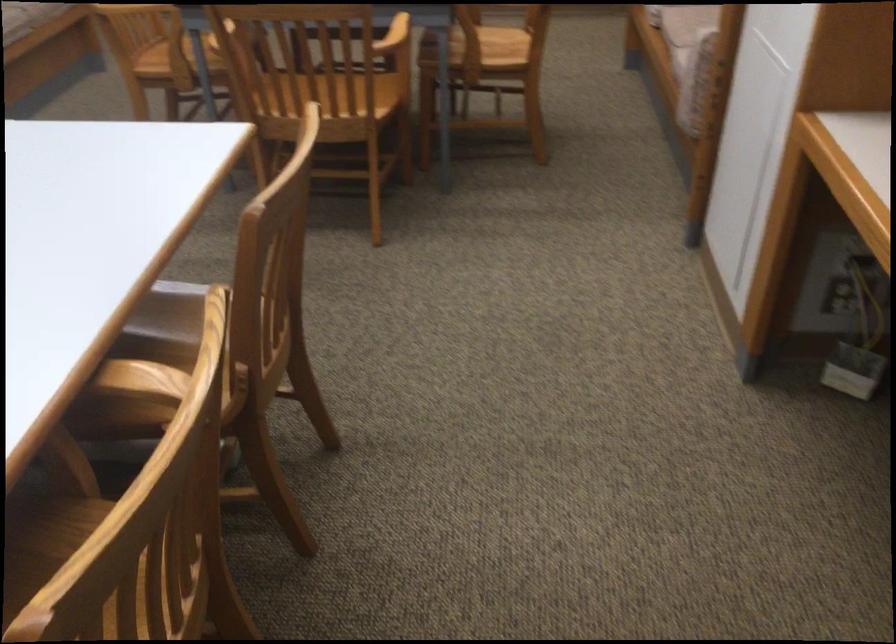
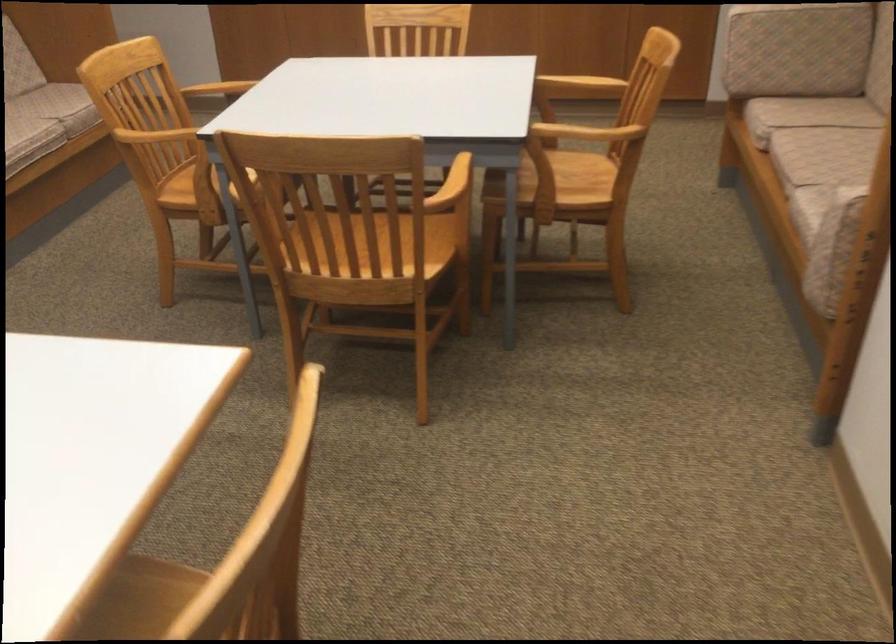
Question: In a continuous first-person perspective shot, in which direction is the camera moving?

Choices:
 (A) Left
 (B) Right
 (C) Forward
 (D) Backward

Answer: (C)